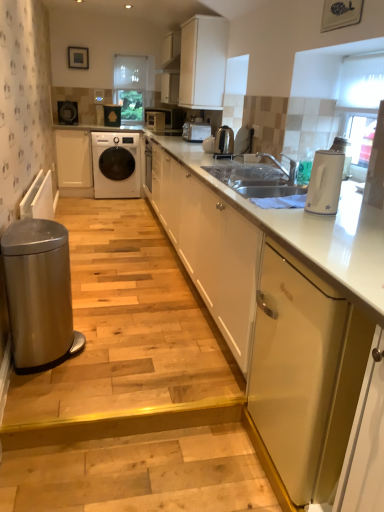
What do you see at coordinates (67, 112) in the screenshot?
I see `brushed metal washing machine at left, arranged as the 1th appliance when viewed from the left` at bounding box center [67, 112].

Measure the distance between brushed metal washing machine at left, the second appliance viewed from the top, and camera.

The distance of brushed metal washing machine at left, the second appliance viewed from the top, from camera is 5.73 meters.

The image size is (384, 512). What are the coordinates of `white glossy toaster at upper center, positioned as the second appliance in bottom-to-top order` in the screenshot? It's located at (196, 130).

Describe the element at coordinates (360, 104) in the screenshot. I see `white frosted glass window at upper right` at that location.

I want to click on natural wood stairs at lower left, the first stair in the front-to-back sequence, so click(x=137, y=462).

Is white glossy washing machine at center in front of matte black microwave at upper center, the 5th appliance ordered from the bottom?

Yes, the depth of white glossy washing machine at center is less than that of matte black microwave at upper center, the 5th appliance ordered from the bottom.

Which is more to the left, white glossy washing machine at center or matte black microwave at upper center, the 5th appliance ordered from the bottom?

white glossy washing machine at center is more to the left.

From the image's perspective, which object appears higher, white glossy washing machine at center or matte black microwave at upper center, arranged as the second appliance when viewed from the left?

matte black microwave at upper center, arranged as the second appliance when viewed from the left, appears higher in the image.

Does point (112, 140) appear closer or farther from the camera than point (106, 112)?

Point (112, 140) is positioned closer to the camera compared to point (106, 112).

Where is `water heater below the matte black microwave at upper center, placed as the first appliance when sorted from back to front (from the image's perspective)`? water heater below the matte black microwave at upper center, placed as the first appliance when sorted from back to front (from the image's perspective) is located at coordinates (39, 294).

From a real-world perspective, who is located lower, matte black microwave at upper center, arranged as the second appliance when viewed from the left, or stainless steel water heater at lower left?

stainless steel water heater at lower left, from a real-world perspective.

Considering the sizes of matte black microwave at upper center, positioned as the 1th appliance in top-to-bottom order, and stainless steel water heater at lower left in the image, is matte black microwave at upper center, positioned as the 1th appliance in top-to-bottom order, taller or shorter than stainless steel water heater at lower left?

matte black microwave at upper center, positioned as the 1th appliance in top-to-bottom order, is shorter than stainless steel water heater at lower left.

Could you measure the distance between matte black microwave at upper center, which is the 5th appliance in front-to-back order, and stainless steel water heater at lower left?

The distance of matte black microwave at upper center, which is the 5th appliance in front-to-back order, from stainless steel water heater at lower left is 4.36 meters.

Is there a large distance between white fabric at center and white glossy toaster at upper center, the 4th appliance viewed from the left?

That's right, there is a large distance between white fabric at center and white glossy toaster at upper center, the 4th appliance viewed from the left.

Can you tell me how much white fabric at center and white glossy toaster at upper center, which appears as the 2th appliance when viewed from the front, differ in facing direction?

The angle between the facing direction of white fabric at center and the facing direction of white glossy toaster at upper center, which appears as the 2th appliance when viewed from the front, is 89.8 degrees.

Can you confirm if white fabric at center is bigger than white glossy toaster at upper center, which is the 2th appliance in right-to-left order?

Correct, white fabric at center is larger in size than white glossy toaster at upper center, which is the 2th appliance in right-to-left order.

Relative to silver metallic tap at center, is matte black microwave at upper center, the 4th appliance when ordered from front to back, in front or behind?

Visually, matte black microwave at upper center, the 4th appliance when ordered from front to back, is located behind silver metallic tap at center.

Is matte black microwave at upper center, positioned as the 3th appliance in top-to-bottom order, far from silver metallic tap at center?

matte black microwave at upper center, positioned as the 3th appliance in top-to-bottom order, is positioned a significant distance from silver metallic tap at center.

In the image, there is a matte black microwave at upper center, arranged as the 2th appliance when viewed from the back. Where is `tap below it (from the image's perspective)`? The width and height of the screenshot is (384, 512). tap below it (from the image's perspective) is located at coordinates (281, 165).

Looking at this image, which is correct: matte black microwave at upper center, which is the third appliance from bottom to top, is inside silver metallic tap at center, or outside of it?

matte black microwave at upper center, which is the third appliance from bottom to top, is outside silver metallic tap at center.

From the picture: Who is bigger, satin nickel kettle at center or white glossy washing machine at center?

white glossy washing machine at center is bigger.

Looking at this image, does satin nickel kettle at center contain white glossy washing machine at center?

That's incorrect, white glossy washing machine at center is not inside satin nickel kettle at center.

In the image, is satin nickel kettle at center on the left side or the right side of white glossy washing machine at center?

Based on their positions, satin nickel kettle at center is located to the right of white glossy washing machine at center.

Is stainless steel water heater at lower left completely or partially outside of matte black microwave at upper center, the 4th appliance viewed from the right?

Yes.

From the image's perspective, would you say stainless steel water heater at lower left is positioned over matte black microwave at upper center, positioned as the 1th appliance in top-to-bottom order?

No, from the image's perspective, stainless steel water heater at lower left is not over matte black microwave at upper center, positioned as the 1th appliance in top-to-bottom order.

Is stainless steel water heater at lower left facing away from matte black microwave at upper center, the 5th appliance ordered from the bottom?

No, matte black microwave at upper center, the 5th appliance ordered from the bottom, is not at the back of stainless steel water heater at lower left.

How far apart are stainless steel water heater at lower left and matte black microwave at upper center, arranged as the second appliance when viewed from the left?

stainless steel water heater at lower left and matte black microwave at upper center, arranged as the second appliance when viewed from the left, are 4.36 meters apart.

Does point (295, 179) appear closer or farther from the camera than point (260, 352)?

Point (295, 179) is positioned farther from the camera compared to point (260, 352).

Is silver metallic tap at center to the left of metallic gold dishwasher at right from the viewer's perspective?

Yes.

From the image's perspective, does silver metallic tap at center appear higher than metallic gold dishwasher at right?

Correct, silver metallic tap at center appears higher than metallic gold dishwasher at right in the image.

From a real-world perspective, which is physically above, silver metallic tap at center or metallic gold dishwasher at right?

silver metallic tap at center, from a real-world perspective.

I want to click on washing machine lying on the left of matte black microwave at upper center, the 4th appliance viewed from the right, so click(116, 164).

Find the location of `appliance that is the 5th one when counting upward from the stainless steel water heater at lower left (from the image's perspective)`. appliance that is the 5th one when counting upward from the stainless steel water heater at lower left (from the image's perspective) is located at coordinates (112, 115).

Looking at the image, which one is located closer to white frosted glass window at upper right, white glossy toaster at upper center, the 4th appliance viewed from the left, or satin nickel kettle at center?

satin nickel kettle at center.

Estimate the real-world distances between objects in this image. Which object is further from white fabric at center, satin nickel kettle at center or metallic gold dishwasher at right?

metallic gold dishwasher at right.

When comparing their distances from white frosted glass window at upper right, does white matte cabinet at center, arranged as the third cabinetry when viewed from the front, or brushed metal washing machine at left, the 4th appliance in the bottom-to-top sequence, seem closer?

white matte cabinet at center, arranged as the third cabinetry when viewed from the front, lies closer to white frosted glass window at upper right than the other object.

Considering their positions, is stainless steel water heater at lower left positioned further to white fabric at center than matte black microwave at upper center, the 4th appliance when ordered from front to back?

stainless steel water heater at lower left.

Which object lies further to the anchor point white frosted glass window at upper right, white fabric at center or silver metallic tap at center?

white fabric at center is positioned further to the anchor white frosted glass window at upper right.

Looking at the image, which one is located further to white frosted glass window at upper right, brushed metal washing machine at left, which is the third appliance in back-to-front order, or matte black microwave at upper center, the 3th appliance when ordered from right to left?

brushed metal washing machine at left, which is the third appliance in back-to-front order, lies further to white frosted glass window at upper right than the other object.

When comparing their distances from white fabric at center, does matte black microwave at upper center, the 4th appliance viewed from the right, or stainless steel trash can at lower left, the second stair in the bottom-to-top sequence, seem closer?

Based on the image, matte black microwave at upper center, the 4th appliance viewed from the right, appears to be nearer to white fabric at center.

Based on their spatial positions, is satin nickel kettle at center or stainless steel trash can at lower left, which appears as the first stair when viewed from the top, closer to metallic gold dishwasher at right?

stainless steel trash can at lower left, which appears as the first stair when viewed from the top, is positioned closer to the anchor metallic gold dishwasher at right.

In order to click on window between white glossy electric kettle at right and matte black microwave at upper center, which is the 5th appliance in front-to-back order, along the z-axis in this screenshot , I will do `click(360, 104)`.

Locate an element on the screen. The image size is (384, 512). water heater located between white glossy cabinet at center, positioned as the 1th cabinetry in front-to-back order, and white matte cabinet at center, arranged as the third cabinetry when viewed from the front, in the depth direction is located at coordinates (39, 294).

In order to click on tap between white glossy electric kettle at right and satin nickel kettle at center along the z-axis in this screenshot , I will do `click(281, 165)`.

You are a GUI agent. You are given a task and a screenshot of the screen. Output one action in this format:
    pyautogui.click(x=<x>, y=<y>)
    Task: Click on the kitchen appliance positioned between natural wood stairs at lower left, arranged as the first stair when ordered from the bottom, and white glossy toaster at upper center, the 4th appliance viewed from the left, from near to far
    
    Given the screenshot: What is the action you would take?
    pyautogui.click(x=224, y=143)